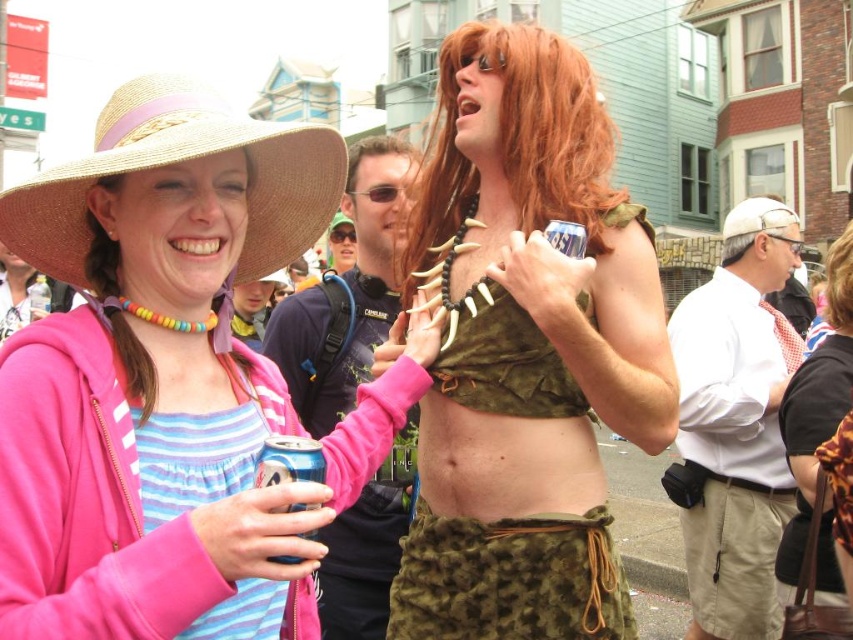
You are a photographer trying to capture the lively street scene. You notice two points in the image at coordinates point (727, 506) and point (831, 307). Which point is closer to your camera lens?

Point (727, 506) is further to the camera than point (831, 307), so the point closer to the camera lens is point (831, 307).

You are a photographer trying to capture a closeup shot of the black plastic goggles at center without including the fuzzy green skirt at center. Given their relative widths, is this possible?

The fuzzy green skirt at center is wider than the black plastic goggles at center. Since the skirt is wider, it might block the view of the goggles if positioned between them and the camera. Adjust your angle to frame the goggles separately.

You are a photographer standing 5 meters away from the camouflage fabric top at center and fuzzy green skirt at center. You want to take a photo that includes both objects in the frame. Can you do it without moving your camera position?

The distance between the camouflage fabric top at center and fuzzy green skirt at center is 3.97 meters. Since you are 5 meters away from both objects, the camera can easily capture both in the frame as they are within the camera lens range.